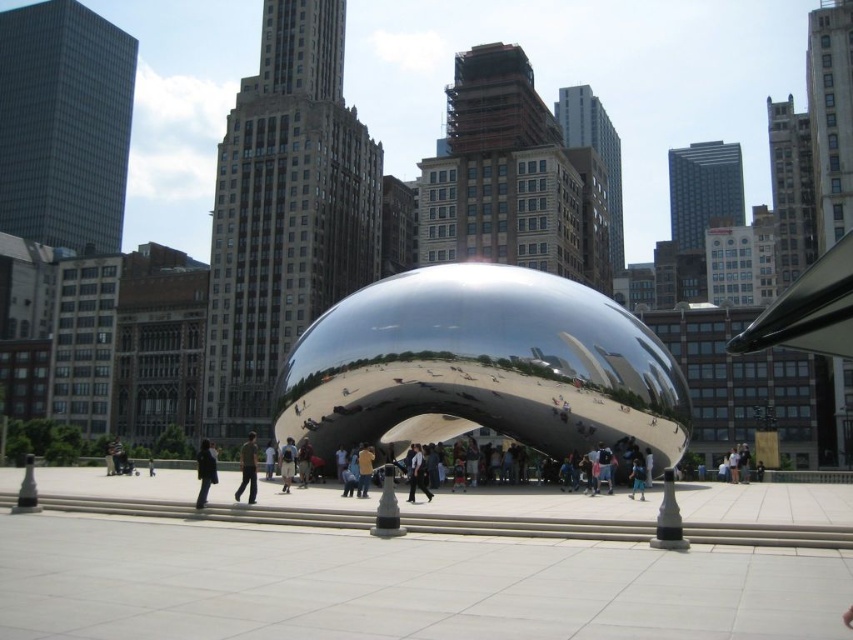
You are a photographer standing in front of Cloud Gate in Millennium Park. You notice two people wearing a light blue shirt at center and a brown leather jacket at center. Which person should you adjust your camera to focus on first if you want to capture the one closer to the right side of the frame?

The light blue shirt at center is to the right of the brown leather jacket at center, so you should focus on the light blue shirt at center first as it is positioned closer to the right side of the frame.